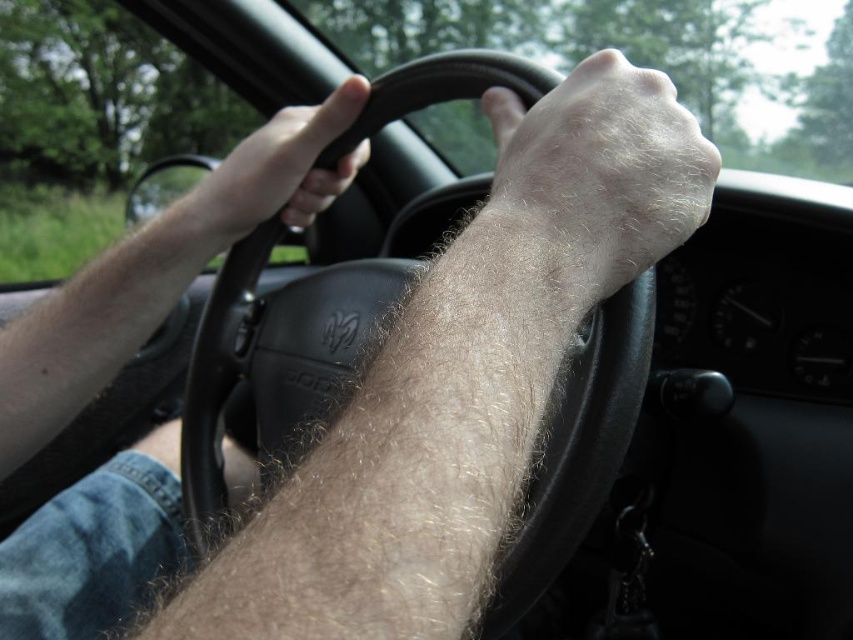
Question: Among these points, which one is nearest to the camera?

Choices:
 (A) (355, 93)
 (B) (635, 193)

Answer: (B)

Question: Does hair-covered skin at center lie in front of matte black steering wheel at left?

Choices:
 (A) no
 (B) yes

Answer: (B)

Question: Can you confirm if hair-covered skin at center is smaller than matte black steering wheel at left?

Choices:
 (A) yes
 (B) no

Answer: (B)

Question: Which point is farther to the camera?

Choices:
 (A) (555, 227)
 (B) (265, 188)

Answer: (B)

Question: Is the position of hair-covered skin at center less distant than that of matte black steering wheel at left?

Choices:
 (A) yes
 (B) no

Answer: (A)